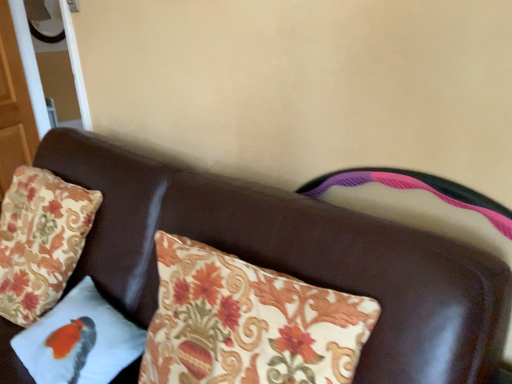
Question: Is white fabric pillow with bird design at lower left, the 2th pillow viewed from the left, positioned with its back to brown leather couch at center?

Choices:
 (A) no
 (B) yes

Answer: (B)

Question: Is white fabric pillow with bird design at lower left, the 2th pillow viewed from the left, taller than brown leather couch at center?

Choices:
 (A) yes
 (B) no

Answer: (B)

Question: Is white fabric pillow with bird design at lower left, the 2th pillow viewed from the left, thinner than brown leather couch at center?

Choices:
 (A) no
 (B) yes

Answer: (B)

Question: Is white fabric pillow with bird design at lower left, the 2th pillow viewed from the left, at the left side of brown leather couch at center?

Choices:
 (A) no
 (B) yes

Answer: (B)

Question: Is white fabric pillow with bird design at lower left, the 2th pillow viewed from the left, outside brown leather couch at center?

Choices:
 (A) yes
 (B) no

Answer: (B)

Question: From the image's perspective, is white fabric pillow with bird design at lower left, positioned as the first pillow in right-to-left order, located above brown leather couch at center?

Choices:
 (A) no
 (B) yes

Answer: (B)

Question: Does brown leather couch at center have a greater width compared to floral fabric pillow at left, arranged as the 1th pillow when viewed from the left?

Choices:
 (A) yes
 (B) no

Answer: (A)

Question: Can you confirm if brown leather couch at center is thinner than floral fabric pillow at left, arranged as the 1th pillow when viewed from the left?

Choices:
 (A) no
 (B) yes

Answer: (A)

Question: Considering the relative positions of brown leather couch at center and floral fabric pillow at left, arranged as the 1th pillow when viewed from the left, in the image provided, is brown leather couch at center to the right of floral fabric pillow at left, arranged as the 1th pillow when viewed from the left, from the viewer's perspective?

Choices:
 (A) yes
 (B) no

Answer: (A)

Question: Does brown leather couch at center have a greater height compared to floral fabric pillow at left, arranged as the 1th pillow when viewed from the left?

Choices:
 (A) no
 (B) yes

Answer: (B)

Question: Is brown leather couch at center at the left side of floral fabric pillow at left, arranged as the 1th pillow when viewed from the left?

Choices:
 (A) yes
 (B) no

Answer: (B)

Question: Is the position of brown leather couch at center more distant than that of floral fabric pillow at left, arranged as the 1th pillow when viewed from the left?

Choices:
 (A) yes
 (B) no

Answer: (B)

Question: Is white fabric pillow with bird design at lower left, the 2th pillow viewed from the left, to the right of floral fabric pillow at left, arranged as the 1th pillow when viewed from the left, from the viewer's perspective?

Choices:
 (A) no
 (B) yes

Answer: (B)